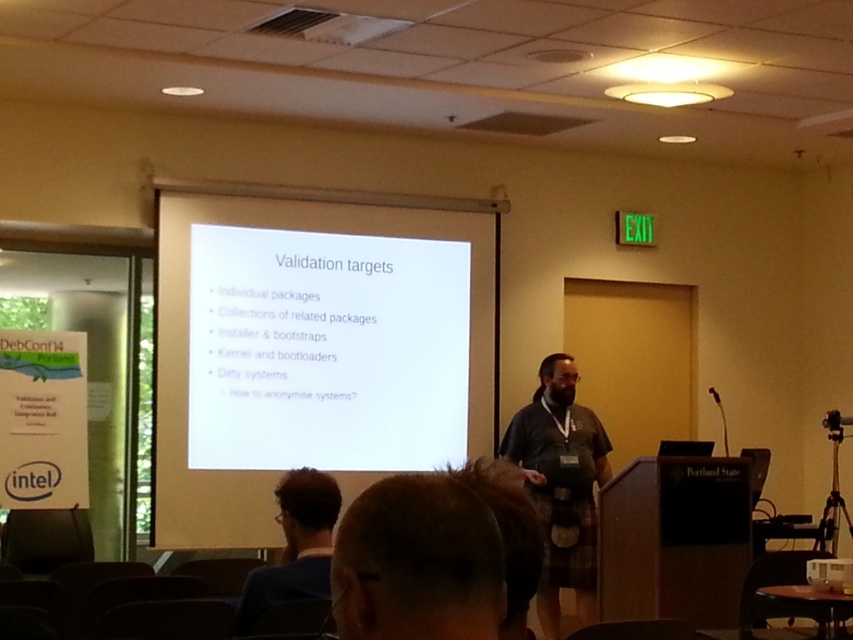
You are an attendee at the presentation and want to take a photo of the slide displayed on the white matte projection screen at center. Since you are seated in the front row, you can use your phone to capture the slide. However, the slide is titled

The slide titled

You are a speaker at the Portland State presentation. You want to ensure your slides on the white matte projection screen at center are visible to everyone in the room. Considering the dark blue fabric at lower left, which is possibly a curtain, could the fabric obstruct the screen? Please explain.

The white matte projection screen at center might be wider than dark blue fabric at lower left, so there is a possibility that the dark blue fabric at lower left could extend beyond the screen, potentially obstructing part of it. However, since the screen might be wider, it might also be positioned in a way that the fabric does not interfere. Without exact measurements, it is uncertain, but the fabric could pose an obstruction risk depending on its placement relative to the screen.

You are a guest attending a presentation at Portland State University. You notice two items in the room, the white matte projection screen at center and the dark blue fabric at lower left. Which of these items is positioned higher from the floor?

The white matte projection screen at center is above dark blue fabric at lower left, so the white matte projection screen at center is positioned higher from the floor.